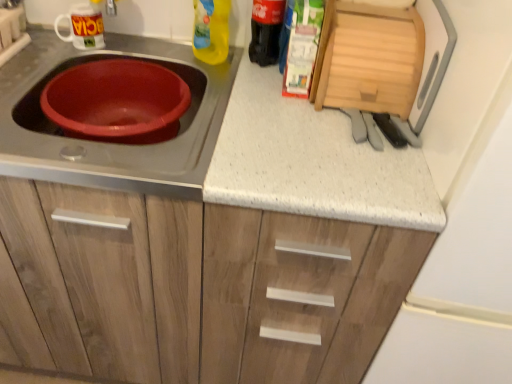
This screenshot has width=512, height=384. What do you see at coordinates (266, 31) in the screenshot? I see `black glass bottle at upper right, which appears as the 2th bottle when viewed from the left` at bounding box center [266, 31].

I want to click on matte plastic basin at left, so click(106, 142).

Considering their positions, is yellow plastic bottle at upper center, which is the 2th bottle in right-to-left order, located in front of or behind black glass bottle at upper right, which appears as the 2th bottle when viewed from the left?

In the image, yellow plastic bottle at upper center, which is the 2th bottle in right-to-left order, appears in front of black glass bottle at upper right, which appears as the 2th bottle when viewed from the left.

Is yellow plastic bottle at upper center, the 1th bottle viewed from the left, thinner than black glass bottle at upper right, positioned as the 1th bottle in right-to-left order?

Result: Correct, the width of yellow plastic bottle at upper center, the 1th bottle viewed from the left, is less than that of black glass bottle at upper right, positioned as the 1th bottle in right-to-left order.

Is yellow plastic bottle at upper center, the 1th bottle viewed from the left, aimed at black glass bottle at upper right, positioned as the 1th bottle in right-to-left order?

No, yellow plastic bottle at upper center, the 1th bottle viewed from the left, does not turn towards black glass bottle at upper right, positioned as the 1th bottle in right-to-left order.

Which is correct: yellow plastic bottle at upper center, the 1th bottle viewed from the left, is inside black glass bottle at upper right, which appears as the 2th bottle when viewed from the left, or outside of it?

The correct answer is: outside.

Between white glossy mug at upper left, the second appliance in the right-to-left sequence, and matte plastic basin at left, which one has larger size?

matte plastic basin at left.

Consider the image. Is the surface of white glossy mug at upper left, the second appliance in the right-to-left sequence, in direct contact with matte plastic basin at left?

There is a gap between white glossy mug at upper left, the second appliance in the right-to-left sequence, and matte plastic basin at left.

Is point (72, 18) farther from viewer compared to point (157, 147)?

That is True.

How much distance is there between white glossy mug at upper left, the second appliance in the right-to-left sequence, and matte plastic basin at left?

white glossy mug at upper left, the second appliance in the right-to-left sequence, and matte plastic basin at left are 10.49 inches apart from each other.

From a real-world perspective, which is physically above, matte plastic basin at left or yellow plastic bottle at upper center, the 1th bottle viewed from the left?

yellow plastic bottle at upper center, the 1th bottle viewed from the left, is physically above.

Which of these two, matte plastic basin at left or yellow plastic bottle at upper center, which is the 2th bottle in right-to-left order, is thinner?

yellow plastic bottle at upper center, which is the 2th bottle in right-to-left order, is thinner.

How many degrees apart are the facing directions of matte plastic basin at left and yellow plastic bottle at upper center, the 1th bottle viewed from the left?

1.9 degrees.

Consider the image. Which of these two, matte plastic basin at left or yellow plastic bottle at upper center, which is the 2th bottle in right-to-left order, is bigger?

With larger size is matte plastic basin at left.

Can you see white glossy mug at upper left, placed as the first appliance when sorted from left to right, touching yellow plastic bottle at upper center, the 1th bottle viewed from the left?

white glossy mug at upper left, placed as the first appliance when sorted from left to right, is not next to yellow plastic bottle at upper center, the 1th bottle viewed from the left, and they're not touching.

Is white glossy mug at upper left, the second appliance in the right-to-left sequence, smaller than yellow plastic bottle at upper center, which is the 2th bottle in right-to-left order?

Yes.

Considering the points (94, 17) and (203, 1), which point is behind, point (94, 17) or point (203, 1)?

The point (94, 17) is more distant.

How distant is white glossy mug at upper left, the second appliance in the right-to-left sequence, from yellow plastic bottle at upper center, the 1th bottle viewed from the left?

10.97 inches.

Between point (362, 106) and point (266, 38), which one is positioned behind?

The point (266, 38) is behind.

Considering the relative sizes of wooden cutting board at upper right, the first appliance viewed from the right, and black glass bottle at upper right, which appears as the 2th bottle when viewed from the left, in the image provided, is wooden cutting board at upper right, the first appliance viewed from the right, shorter than black glass bottle at upper right, which appears as the 2th bottle when viewed from the left,?

Indeed, wooden cutting board at upper right, the first appliance viewed from the right, has a lesser height compared to black glass bottle at upper right, which appears as the 2th bottle when viewed from the left.

Is wooden cutting board at upper right, the second appliance from the left, oriented away from black glass bottle at upper right, which appears as the 2th bottle when viewed from the left?

That's not correct — wooden cutting board at upper right, the second appliance from the left, is not looking away from black glass bottle at upper right, which appears as the 2th bottle when viewed from the left.

Could you tell me if yellow plastic bottle at upper center, the 1th bottle viewed from the left, is turned towards white glossy mug at upper left, the second appliance in the right-to-left sequence?

No, yellow plastic bottle at upper center, the 1th bottle viewed from the left, is not aimed at white glossy mug at upper left, the second appliance in the right-to-left sequence.

Based on their sizes in the image, would you say yellow plastic bottle at upper center, which is the 2th bottle in right-to-left order, is bigger or smaller than white glossy mug at upper left, the second appliance in the right-to-left sequence?

In the image, yellow plastic bottle at upper center, which is the 2th bottle in right-to-left order, appears to be larger than white glossy mug at upper left, the second appliance in the right-to-left sequence.

Is yellow plastic bottle at upper center, the 1th bottle viewed from the left, next to white glossy mug at upper left, the second appliance in the right-to-left sequence, and touching it?

There is a gap between yellow plastic bottle at upper center, the 1th bottle viewed from the left, and white glossy mug at upper left, the second appliance in the right-to-left sequence.

Can you tell me how much matte plastic basin at left and black glass bottle at upper right, positioned as the 1th bottle in right-to-left order, differ in facing direction?

The angle between the facing direction of matte plastic basin at left and the facing direction of black glass bottle at upper right, positioned as the 1th bottle in right-to-left order, is 0.000513 degrees.

In the scene shown: Is the position of matte plastic basin at left less distant than that of black glass bottle at upper right, positioned as the 1th bottle in right-to-left order?

That is True.

Which is more to the right, matte plastic basin at left or black glass bottle at upper right, positioned as the 1th bottle in right-to-left order?

From the viewer's perspective, black glass bottle at upper right, positioned as the 1th bottle in right-to-left order, appears more on the right side.

Starting from the matte plastic basin at left, which bottle is the 2nd one behind? Please provide its 2D coordinates.

[(266, 31)]

In order to click on bottle located behind the yellow plastic bottle at upper center, which is the 2th bottle in right-to-left order in this screenshot , I will do `click(266, 31)`.

From a real-world perspective, which appliance is the 1st one above the matte plastic basin at left? Please provide its 2D coordinates.

[(83, 27)]

When comparing their distances from wooden cutting board at upper right, the second appliance from the left, does white glossy mug at upper left, the second appliance in the right-to-left sequence, or black glass bottle at upper right, positioned as the 1th bottle in right-to-left order, seem closer?

black glass bottle at upper right, positioned as the 1th bottle in right-to-left order, is positioned closer to the anchor wooden cutting board at upper right, the second appliance from the left.

When comparing their distances from yellow plastic bottle at upper center, the 1th bottle viewed from the left, does white speckled laminate at center or matte plastic basin at left seem further?

white speckled laminate at center.

Considering their positions, is matte plastic basin at left positioned closer to white speckled laminate at center than wooden cutting board at upper right, the first appliance viewed from the right?

matte plastic basin at left lies closer to white speckled laminate at center than the other object.

Which object lies further to the anchor point white speckled laminate at center, white glossy mug at upper left, placed as the first appliance when sorted from left to right, or yellow plastic bottle at upper center, which is the 2th bottle in right-to-left order?

Among the two, white glossy mug at upper left, placed as the first appliance when sorted from left to right, is located further to white speckled laminate at center.

When comparing their distances from black glass bottle at upper right, which appears as the 2th bottle when viewed from the left, does matte plastic basin at left or wooden cutting board at upper right, the second appliance from the left, seem further?

matte plastic basin at left is positioned further to the anchor black glass bottle at upper right, which appears as the 2th bottle when viewed from the left.

Which object lies further to the anchor point yellow plastic bottle at upper center, the 1th bottle viewed from the left, matte plastic basin at left or white glossy mug at upper left, placed as the first appliance when sorted from left to right?

matte plastic basin at left lies further to yellow plastic bottle at upper center, the 1th bottle viewed from the left, than the other object.

Estimate the real-world distances between objects in this image. Which object is closer to black glass bottle at upper right, positioned as the 1th bottle in right-to-left order, white glossy mug at upper left, placed as the first appliance when sorted from left to right, or yellow plastic bottle at upper center, the 1th bottle viewed from the left?

The object closer to black glass bottle at upper right, positioned as the 1th bottle in right-to-left order, is yellow plastic bottle at upper center, the 1th bottle viewed from the left.

Based on their spatial positions, is matte plastic basin at left or white speckled laminate at center further from black glass bottle at upper right, positioned as the 1th bottle in right-to-left order?

Based on the image, white speckled laminate at center appears to be further to black glass bottle at upper right, positioned as the 1th bottle in right-to-left order.

Locate an element on the screen. The height and width of the screenshot is (384, 512). gas stove between white glossy mug at upper left, placed as the first appliance when sorted from left to right, and white speckled laminate at center vertically is located at coordinates pyautogui.click(x=106, y=142).

Where is `bottle between yellow plastic bottle at upper center, the 1th bottle viewed from the left, and wooden cutting board at upper right, the first appliance viewed from the right, from left to right`? This screenshot has width=512, height=384. bottle between yellow plastic bottle at upper center, the 1th bottle viewed from the left, and wooden cutting board at upper right, the first appliance viewed from the right, from left to right is located at coordinates (266, 31).

Identify the location of countertop between matte plastic basin at left and wooden cutting board at upper right, the second appliance from the left, in the horizontal direction. click(x=223, y=145).

Locate an element on the screen. The height and width of the screenshot is (384, 512). bottle between white glossy mug at upper left, placed as the first appliance when sorted from left to right, and black glass bottle at upper right, which appears as the 2th bottle when viewed from the left, in the horizontal direction is located at coordinates (211, 30).